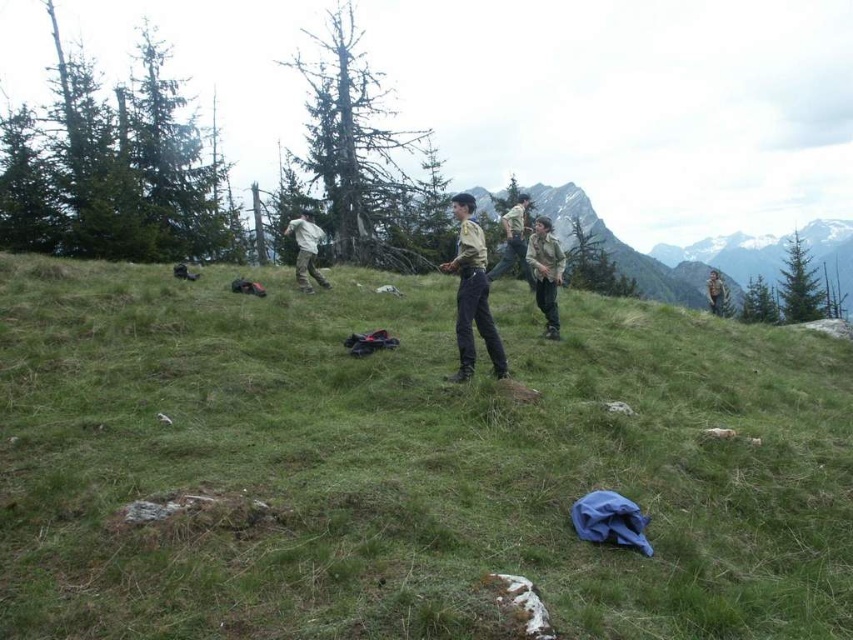
You are a member of the group on the grassy hillside. You notice two points marked on the slope. The first point is at coordinate point (x=465, y=339) and the second is at point (x=718, y=314). If you want to reach the point that is closer to you, which coordinate should you head towards?

You should head towards point (x=465, y=339) because it is closer to the camera, which represents your current position.

You are a member of the group standing on the grassy hillside. You notice a specific point marked at coordinates (514, 241). Where exactly is this point located on your uniform?

The point at (514, 241) is located on the khaki uniform at center.

You are standing on the grassy hillside and need to locate the green grassy at center. According to the coordinates provided, where would you find it?

The green grassy at center is located at point coordinates of (405,465).